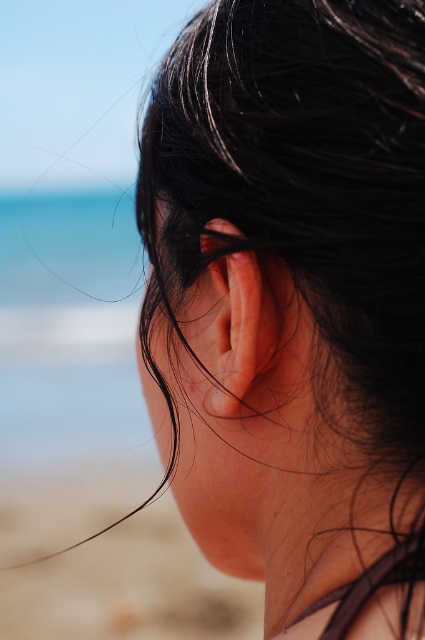
Question: Which point is closer to the camera?

Choices:
 (A) black shiny hair at center
 (B) beige sand at lower left
 (C) pink flesh-colored ear at center

Answer: (A)

Question: Is black shiny hair at center thinner than pink flesh-colored ear at center?

Choices:
 (A) no
 (B) yes

Answer: (A)

Question: Among these points, which one is nearest to the camera?

Choices:
 (A) (164, 589)
 (B) (207, 333)
 (C) (390, 237)

Answer: (C)

Question: Observing the image, what is the correct spatial positioning of black shiny hair at center in reference to pink flesh-colored ear at center?

Choices:
 (A) below
 (B) above

Answer: (B)

Question: Which point is farther to the camera?

Choices:
 (A) black shiny hair at center
 (B) beige sand at lower left

Answer: (B)

Question: Is beige sand at lower left closer to camera compared to pink flesh-colored ear at center?

Choices:
 (A) no
 (B) yes

Answer: (A)